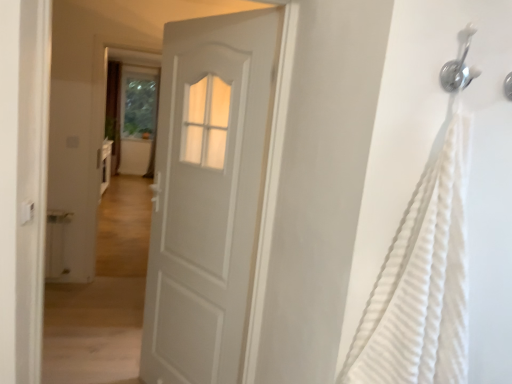
Where is `white textured fabric at right`? This screenshot has height=384, width=512. white textured fabric at right is located at coordinates (422, 279).

What do you see at coordinates (138, 120) in the screenshot? Image resolution: width=512 pixels, height=384 pixels. I see `transparent glass screen door at upper center` at bounding box center [138, 120].

Describe the element at coordinates (208, 195) in the screenshot. The image size is (512, 384). I see `white matte door at center` at that location.

At what (x,y) coordinates should I click in order to perform the action: click on white textured fabric at right. Please return your answer as a coordinate pair (x, y). The height and width of the screenshot is (384, 512). Looking at the image, I should click on (422, 279).

From a real-world perspective, relative to white textured fabric at right, is transparent glass screen door at upper center vertically above or below?

Clearly, from a real-world perspective, transparent glass screen door at upper center is below white textured fabric at right.

Considering the positions of objects transparent glass screen door at upper center and white textured fabric at right in the image provided, who is in front, transparent glass screen door at upper center or white textured fabric at right?

white textured fabric at right.

How many degrees apart are the facing directions of transparent glass screen door at upper center and white textured fabric at right?

The angular difference between transparent glass screen door at upper center and white textured fabric at right is 0.892 degrees.

Which is in front, point (151, 127) or point (452, 289)?

Positioned in front is point (452, 289).

Considering the sizes of objects white textured fabric at right and white matte door at center in the image provided, who is smaller, white textured fabric at right or white matte door at center?

Smaller between the two is white textured fabric at right.

What's the angular difference between white textured fabric at right and white matte door at center's facing directions?

The angle between the facing direction of white textured fabric at right and the facing direction of white matte door at center is 58.7 degrees.

Is white textured fabric at right at the left side of white matte door at center?

In fact, white textured fabric at right is to the right of white matte door at center.

Considering the points (455, 278) and (230, 61), which point is behind, point (455, 278) or point (230, 61)?

The point (230, 61) is more distant.

Is silver metallic shower head at upper right to the right of white matte door at center from the viewer's perspective?

Yes.

Considering the relative sizes of silver metallic shower head at upper right and white matte door at center in the image provided, is silver metallic shower head at upper right wider than white matte door at center?

In fact, silver metallic shower head at upper right might be narrower than white matte door at center.

Based on their sizes in the image, would you say silver metallic shower head at upper right is bigger or smaller than white matte door at center?

Considering their sizes, silver metallic shower head at upper right takes up less space than white matte door at center.

Where is `shower located in front of the transparent glass screen door at upper center`? The height and width of the screenshot is (384, 512). shower located in front of the transparent glass screen door at upper center is located at coordinates (459, 66).

Does point (465, 78) come behind point (128, 65)?

No, (465, 78) is in front of (128, 65).

Between silver metallic shower head at upper right and transparent glass screen door at upper center, which one has more height?

Standing taller between the two is transparent glass screen door at upper center.

Is silver metallic shower head at upper right with transparent glass screen door at upper center?

No, silver metallic shower head at upper right is not in contact with transparent glass screen door at upper center.

Which is more distant, (x=250, y=131) or (x=452, y=302)?

Positioned behind is point (x=250, y=131).

From the image's perspective, would you say white matte door at center is shown under white textured fabric at right?

Indeed, from the image's perspective, white matte door at center is shown beneath white textured fabric at right.

Can you confirm if white matte door at center is wider than white textured fabric at right?

In fact, white matte door at center might be narrower than white textured fabric at right.

Which object is further away from the camera, white matte door at center or white textured fabric at right?

white matte door at center is further away from the camera.

From the image's perspective, is transparent glass screen door at upper center located above or below silver metallic shower head at upper right?

transparent glass screen door at upper center is above silver metallic shower head at upper right.

Can you tell me how much transparent glass screen door at upper center and silver metallic shower head at upper right differ in facing direction?

0.893 degrees.

Which point is more forward, (147, 112) or (447, 68)?

The point (447, 68) is closer to the camera.

Considering the sizes of objects transparent glass screen door at upper center and silver metallic shower head at upper right in the image provided, who is bigger, transparent glass screen door at upper center or silver metallic shower head at upper right?

transparent glass screen door at upper center is bigger.

Is silver metallic shower head at upper right completely or partially outside of white textured fabric at right?

Yes, silver metallic shower head at upper right is not within white textured fabric at right.

Considering their positions, is silver metallic shower head at upper right located in front of or behind white textured fabric at right?

silver metallic shower head at upper right is positioned farther from the viewer than white textured fabric at right.

Does silver metallic shower head at upper right turn towards white textured fabric at right?

No, silver metallic shower head at upper right is not turned towards white textured fabric at right.

Where is `screen door located behind the white textured fabric at right`? screen door located behind the white textured fabric at right is located at coordinates (138, 120).

You are a GUI agent. You are given a task and a screenshot of the screen. Output one action in this format:
    pyautogui.click(x=<x>, y=<y>)
    Task: Click on the door located underneath the white textured fabric at right (from a real-world perspective)
    
    Given the screenshot: What is the action you would take?
    pyautogui.click(x=208, y=195)

When comparing their distances from white matte door at center, does silver metallic shower head at upper right or transparent glass screen door at upper center seem further?

The object further to white matte door at center is transparent glass screen door at upper center.

When comparing their distances from silver metallic shower head at upper right, does transparent glass screen door at upper center or white matte door at center seem further?

transparent glass screen door at upper center is positioned further to the anchor silver metallic shower head at upper right.

When comparing their distances from silver metallic shower head at upper right, does white matte door at center or white textured fabric at right seem closer?

white textured fabric at right is closer to silver metallic shower head at upper right.

Looking at the image, which one is located closer to silver metallic shower head at upper right, transparent glass screen door at upper center or white textured fabric at right?

white textured fabric at right is positioned closer to the anchor silver metallic shower head at upper right.

Looking at the image, which one is located closer to silver metallic shower head at upper right, white matte door at center or transparent glass screen door at upper center?

white matte door at center is positioned closer to the anchor silver metallic shower head at upper right.

Based on their spatial positions, is silver metallic shower head at upper right or white matte door at center further from white textured fabric at right?

Among the two, white matte door at center is located further to white textured fabric at right.

Which object lies nearer to the anchor point white textured fabric at right, transparent glass screen door at upper center or silver metallic shower head at upper right?

Among the two, silver metallic shower head at upper right is located nearer to white textured fabric at right.

Looking at the image, which one is located closer to white textured fabric at right, silver metallic shower head at upper right or transparent glass screen door at upper center?

The object closer to white textured fabric at right is silver metallic shower head at upper right.

Image resolution: width=512 pixels, height=384 pixels. Identify the location of door between silver metallic shower head at upper right and transparent glass screen door at upper center along the z-axis. tap(208, 195).

The image size is (512, 384). In order to click on door positioned between white textured fabric at right and transparent glass screen door at upper center from near to far in this screenshot , I will do `click(208, 195)`.

The height and width of the screenshot is (384, 512). Identify the location of shower located between white textured fabric at right and white matte door at center in the depth direction. (459, 66).

This screenshot has width=512, height=384. I want to click on shower between white textured fabric at right and transparent glass screen door at upper center along the z-axis, so click(459, 66).